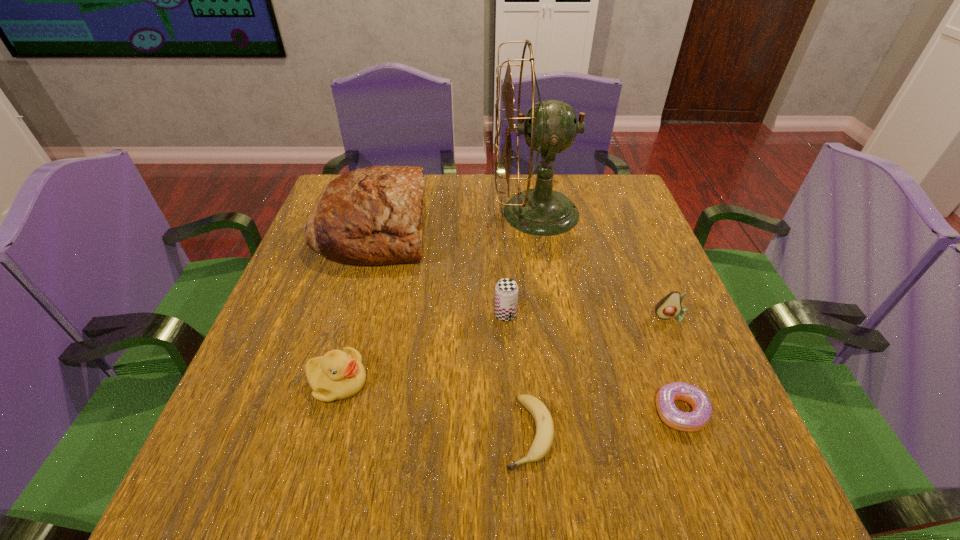
Where is `free space between the beer can and the avocado`? free space between the beer can and the avocado is located at coordinates click(x=588, y=316).

Image resolution: width=960 pixels, height=540 pixels. I want to click on free spot between the bread and the fan, so click(x=455, y=220).

You are a GUI agent. You are given a task and a screenshot of the screen. Output one action in this format:
    pyautogui.click(x=<x>, y=<y>)
    Task: Click on the blank region between the sixth shortest object and the beer can
    The height and width of the screenshot is (540, 960).
    Given the screenshot: What is the action you would take?
    pyautogui.click(x=440, y=272)

Find the location of `blank region between the bread and the sixth tallest object`. blank region between the bread and the sixth tallest object is located at coordinates (527, 320).

Where is `free spot between the shortest object and the beer can`? free spot between the shortest object and the beer can is located at coordinates (517, 373).

The image size is (960, 540). What are the coordinates of `blank region between the bread and the tallest object` in the screenshot? It's located at (455, 220).

The width and height of the screenshot is (960, 540). Identify the location of empty space between the duckling and the banana. (433, 407).

Find the location of `free space between the beer can and the avocado`. free space between the beer can and the avocado is located at coordinates (588, 316).

At what (x,y) coordinates should I click in order to perform the action: click on free space between the avocado and the beer can. Please return your answer as a coordinate pair (x, y). Looking at the image, I should click on (588, 316).

Choose which object is the sixth nearest neighbor to the avocado. Please provide its 2D coordinates. Your answer should be formatted as a tuple, i.e. [(x, y)], where the tuple contains the x and y coordinates of a point satisfying the conditions above.

[(338, 375)]